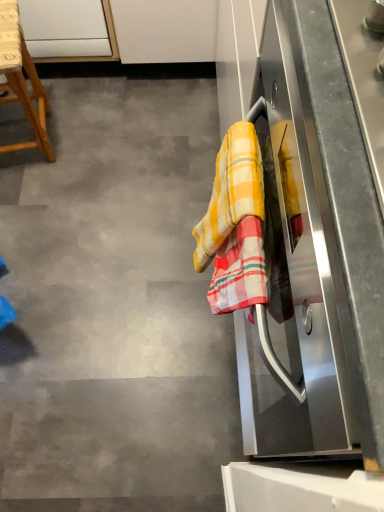
Where is `vacant area in front of wooden stool at left`? Image resolution: width=384 pixels, height=512 pixels. vacant area in front of wooden stool at left is located at coordinates (40, 194).